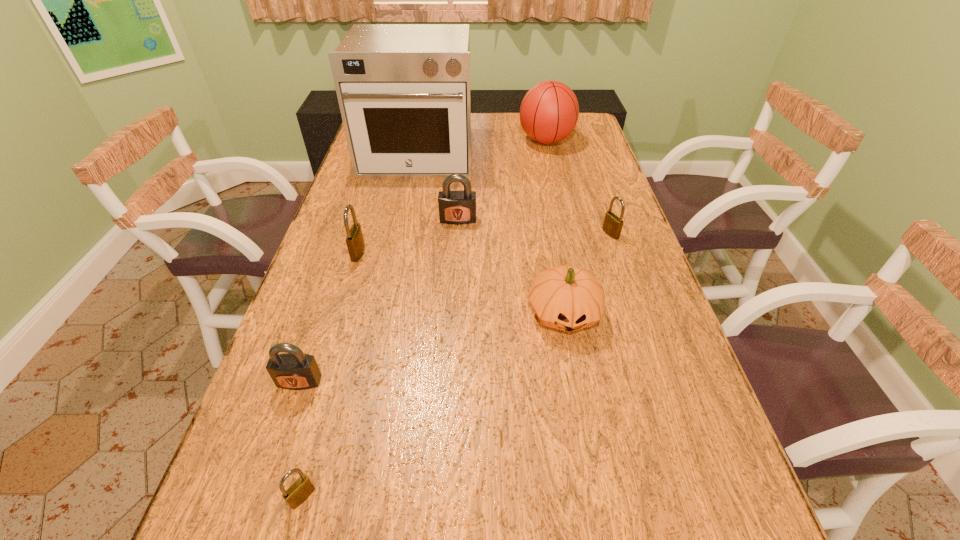
At what (x,y) coordinates should I click in order to perform the action: click on free area in between the right gray padlock and the shortest padlock. Please return your answer as a coordinate pair (x, y). Looking at the image, I should click on (380, 358).

Select which object appears as the fourth closest to the left gray padlock. Please provide its 2D coordinates. Your answer should be formatted as a tuple, i.e. [(x, y)], where the tuple contains the x and y coordinates of a point satisfying the conditions above.

[(457, 207)]

The height and width of the screenshot is (540, 960). Find the location of `object that is the third closest to the rightmost padlock`. object that is the third closest to the rightmost padlock is located at coordinates (549, 111).

Point out which padlock is positioned as the nearest to the rightmost brass padlock. Please provide its 2D coordinates. Your answer should be formatted as a tuple, i.e. [(x, y)], where the tuple contains the x and y coordinates of a point satisfying the conditions above.

[(457, 207)]

The width and height of the screenshot is (960, 540). I want to click on the third closest padlock to the bigger gray padlock, so click(x=294, y=370).

Point out which brass padlock is positioned as the second nearest to the basketball. Please provide its 2D coordinates. Your answer should be formatted as a tuple, i.e. [(x, y)], where the tuple contains the x and y coordinates of a point satisfying the conditions above.

[(355, 243)]

Locate an element on the screen. brass padlock that is the second closest one to the fifth nearest object is located at coordinates (301, 489).

I want to click on gray padlock that is the closest to the second tallest object, so click(x=457, y=207).

Locate an element on the screen. This screenshot has height=540, width=960. blank space that satisfies the following two spatial constraints: 1. on the front side of the basketball; 2. on the right side of the second smallest brass padlock is located at coordinates [567, 234].

Locate an element on the screen. The image size is (960, 540). vacant space that satisfies the following two spatial constraints: 1. on the front of the shortest object near the keyhole; 2. on the left side of the left gray padlock is located at coordinates (260, 497).